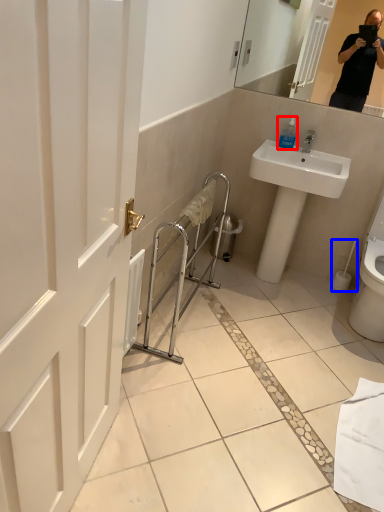
Question: Which object is further to the camera taking this photo, soap dispenser (highlighted by a red box) or toilet paper (highlighted by a blue box)?

Choices:
 (A) soap dispenser
 (B) toilet paper

Answer: (B)